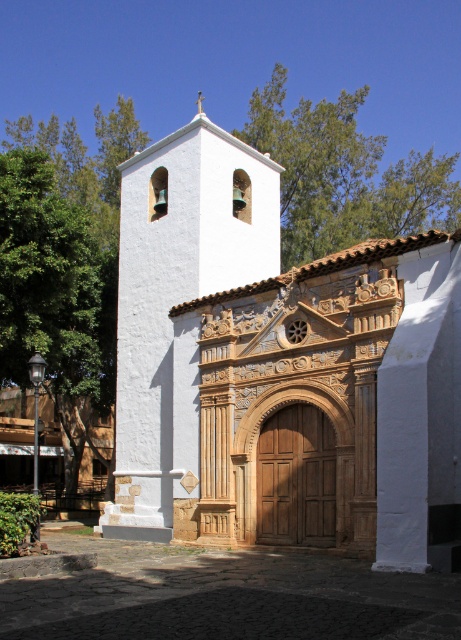
You are standing in front of the church and want to take a photo of both the white stucco church at center and the white stucco bell tower at upper left. Based on their positions, which one should you pan your camera towards first to ensure both are in frame?

You should pan your camera towards the white stucco bell tower at upper left first because the white stucco church at center is to the right of it, so by starting at the bell tower, you can then adjust to include the church to its right in the frame.

You are standing in front of the white stucco church at center. What are the coordinates of the church in the image?

The white stucco church at center is located at coordinates point (278, 369).

You are a tourist standing in front of the white stucco church at center and the white stucco bell tower at upper left. Which structure is taller?

The white stucco bell tower at upper left is taller than the white stucco church at center.